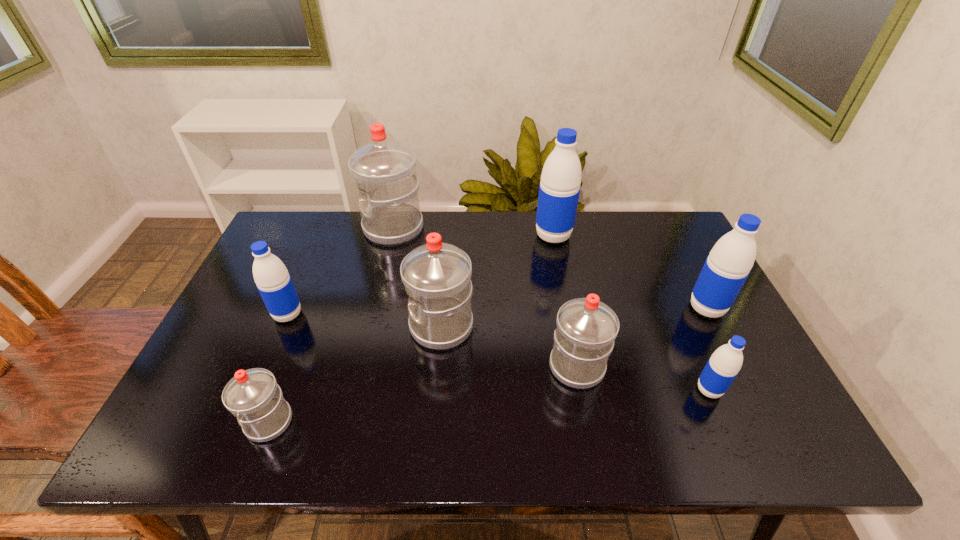
I want to click on vacant space that satisfies the following two spatial constraints: 1. on the handle side of the farthest white water bottle; 2. on the left side of the nearest blue water bottle, so click(x=355, y=390).

Identify the location of free space that satisfies the following two spatial constraints: 1. on the handle side of the third blue water bottle from left to right; 2. on the left side of the third water bottle from left to right. The height and width of the screenshot is (540, 960). (355, 390).

Where is `vacant space that satisfies the following two spatial constraints: 1. on the handle side of the biggest white water bottle; 2. on the right side of the rightmost water bottle`? This screenshot has width=960, height=540. vacant space that satisfies the following two spatial constraints: 1. on the handle side of the biggest white water bottle; 2. on the right side of the rightmost water bottle is located at coordinates (374, 308).

Identify the location of vacant space that satisfies the following two spatial constraints: 1. on the handle side of the second biggest white water bottle; 2. on the right side of the nearest blue water bottle. The width and height of the screenshot is (960, 540). (436, 390).

Image resolution: width=960 pixels, height=540 pixels. I want to click on vacant area in the image that satisfies the following two spatial constraints: 1. on the handle side of the third smallest white water bottle; 2. on the handle side of the third biggest white water bottle, so click(x=438, y=367).